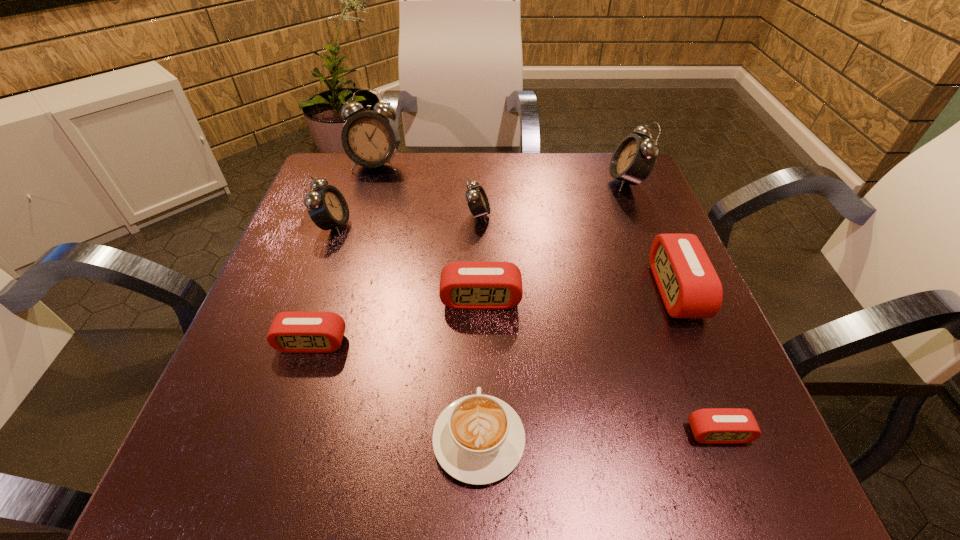
Identify the location of the third nearest object. The image size is (960, 540). (292, 332).

This screenshot has width=960, height=540. Find the location of `the second nearest alarm clock`. the second nearest alarm clock is located at coordinates (292, 332).

Identify the location of cappuccino. The width and height of the screenshot is (960, 540). (478, 439).

Locate an element on the screen. the shortest object is located at coordinates (713, 425).

You are a GUI agent. You are given a task and a screenshot of the screen. Output one action in this format:
    pyautogui.click(x=<x>, y=<y>)
    Task: Click on the shortest alarm clock
    The height and width of the screenshot is (540, 960).
    Given the screenshot: What is the action you would take?
    pyautogui.click(x=713, y=425)

Where is `vacant space situated on the face of the tallest object`? Image resolution: width=960 pixels, height=540 pixels. vacant space situated on the face of the tallest object is located at coordinates (350, 248).

Where is `vacant space located on the face of the second biggest white alarm clock`? vacant space located on the face of the second biggest white alarm clock is located at coordinates (544, 181).

Where is `vacant space situated 0.180m on the face of the second biggest white alarm clock`? This screenshot has height=540, width=960. vacant space situated 0.180m on the face of the second biggest white alarm clock is located at coordinates (537, 181).

Where is `vacant space located 0.110m on the face of the second biggest white alarm clock`? vacant space located 0.110m on the face of the second biggest white alarm clock is located at coordinates (564, 181).

Identify the location of vacant point located 0.070m on the face of the third tallest alarm clock. (382, 226).